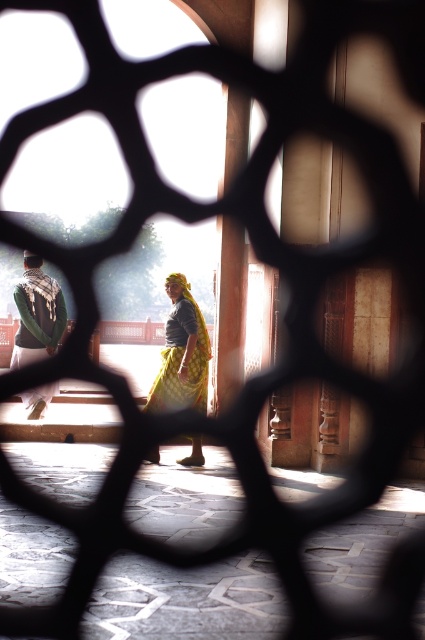
Which is behind, point (197, 305) or point (22, 352)?

The point (197, 305) is more distant.

Can you confirm if yellow fabric skirt at center is positioned to the right of green fabric shawl at left?

Yes, yellow fabric skirt at center is to the right of green fabric shawl at left.

Which is behind, point (201, 362) or point (30, 305)?

Point (30, 305)

The height and width of the screenshot is (640, 425). Find the location of `yellow fabric skirt at center`. yellow fabric skirt at center is located at coordinates (181, 353).